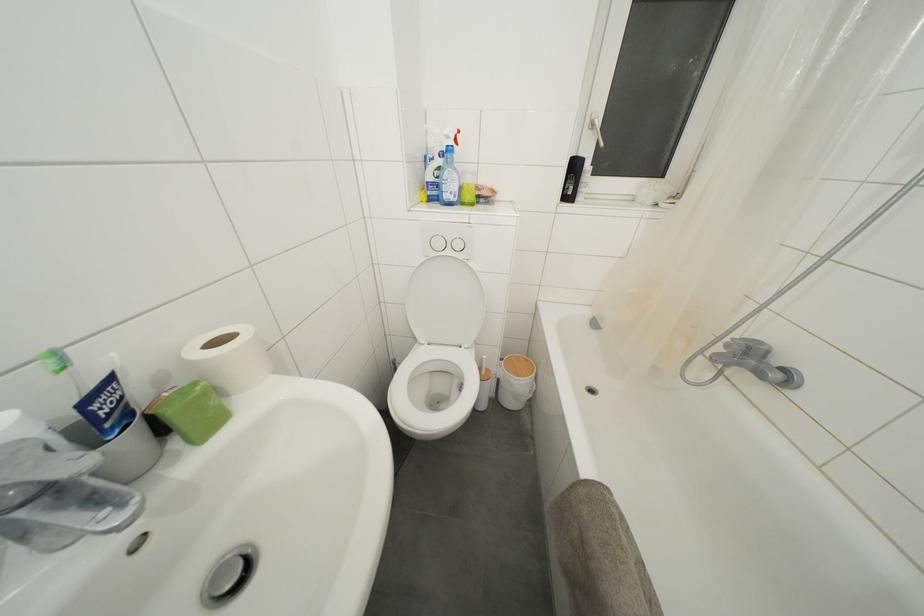
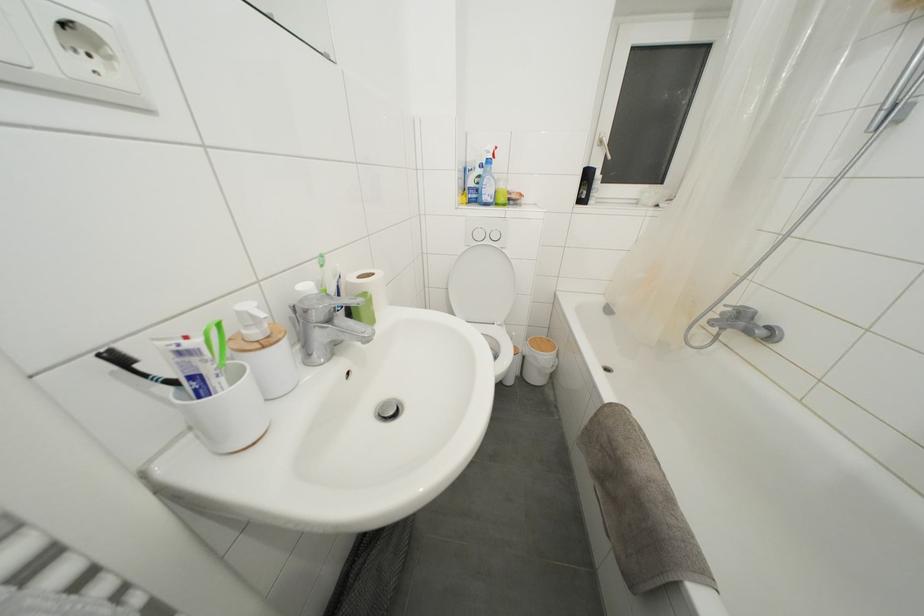
Locate, in the second image, the point that corresponds to (451,201) in the first image.

(490, 203)